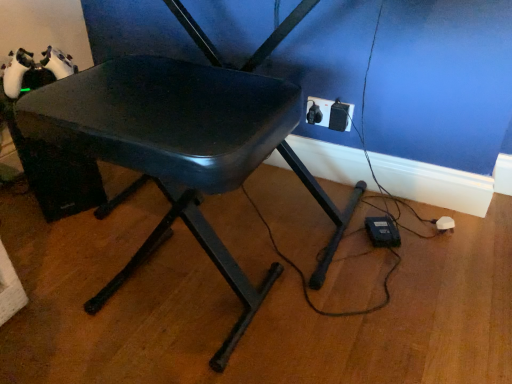
Question: Based on their positions, is black plastic outlet at lower right located to the left or right of matte black chair at center?

Choices:
 (A) right
 (B) left

Answer: (A)

Question: Is point (310, 122) positioned closer to the camera than point (217, 258)?

Choices:
 (A) closer
 (B) farther

Answer: (B)

Question: Is black plastic outlet at lower right taller or shorter than matte black chair at center?

Choices:
 (A) tall
 (B) short

Answer: (B)

Question: Is point coord(198,117) closer or farther from the camera than point coord(321,117)?

Choices:
 (A) closer
 (B) farther

Answer: (A)

Question: Considering the positions of matte black chair at center and black plastic outlet at lower right in the image, is matte black chair at center wider or thinner than black plastic outlet at lower right?

Choices:
 (A) thin
 (B) wide

Answer: (B)

Question: From a real-world perspective, is matte black chair at center positioned above or below black plastic outlet at lower right?

Choices:
 (A) above
 (B) below

Answer: (A)

Question: Considering the positions of matte black chair at center and black plastic outlet at lower right in the image, is matte black chair at center taller or shorter than black plastic outlet at lower right?

Choices:
 (A) short
 (B) tall

Answer: (B)